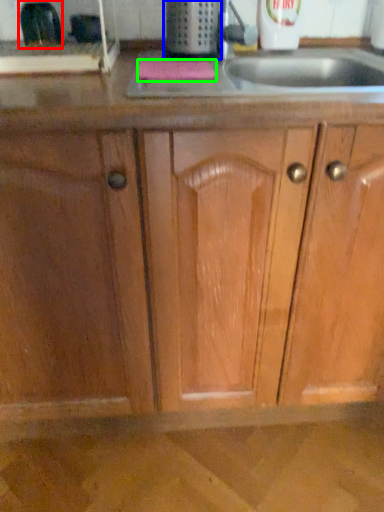
Question: Which is farther away from appliance (highlighted by a red box)? appliance (highlighted by a blue box) or soap (highlighted by a green box)?

Choices:
 (A) appliance
 (B) soap

Answer: (A)